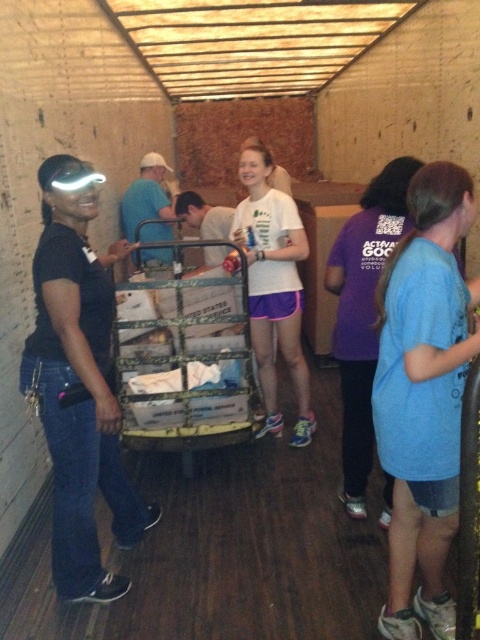
Based on the photo, can you confirm if matte black shirt at left is taller than camouflage metal trolley at center?

Indeed, matte black shirt at left has a greater height compared to camouflage metal trolley at center.

Is matte black shirt at left shorter than camouflage metal trolley at center?

In fact, matte black shirt at left may be taller than camouflage metal trolley at center.

This screenshot has height=640, width=480. What do you see at coordinates (78, 385) in the screenshot?
I see `matte black shirt at left` at bounding box center [78, 385].

At what (x,y) coordinates should I click in order to perform the action: click on matte black shirt at left. Please return your answer as a coordinate pair (x, y). This screenshot has height=640, width=480. Looking at the image, I should click on (78, 385).

Is blue cotton shirt at right wider than camouflage metal trolley at center?

No.

Does blue cotton shirt at right appear on the left side of camouflage metal trolley at center?

In fact, blue cotton shirt at right is to the right of camouflage metal trolley at center.

Where is `blue cotton shirt at right`? blue cotton shirt at right is located at coordinates (423, 394).

In order to click on blue cotton shirt at right in this screenshot , I will do `click(423, 394)`.

Is camouflage metal trolley at center behind white matte t-shirt at center?

No.

From the picture: Is camouflage metal trolley at center to the right of white matte t-shirt at center from the viewer's perspective?

In fact, camouflage metal trolley at center is to the left of white matte t-shirt at center.

Does point (179, 310) lie in front of point (252, 172)?

Yes.

Find the location of a particular element. camouflage metal trolley at center is located at coordinates (190, 369).